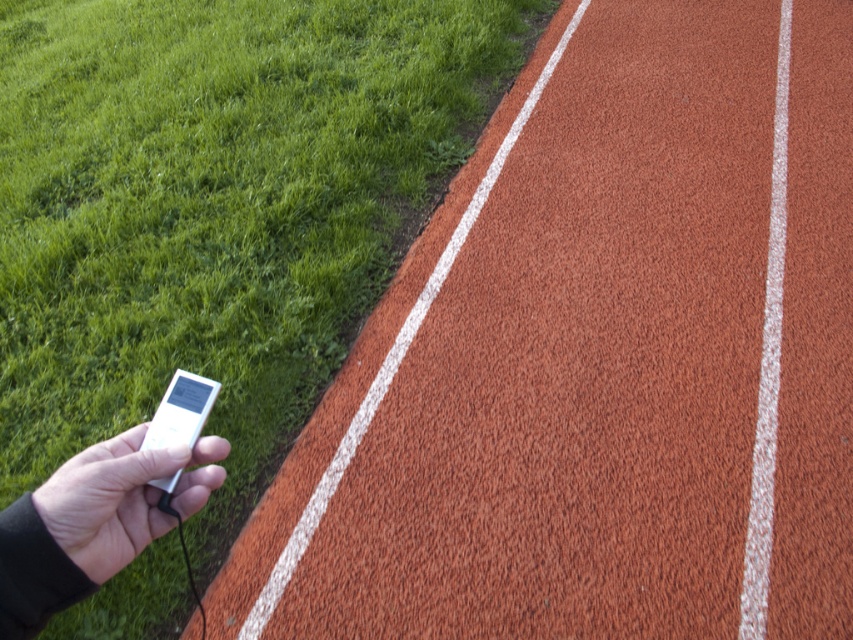
Question: Does white matte ipod at lower left appear on the right side of white matte/silicone mp3 player at lower left?

Choices:
 (A) yes
 (B) no

Answer: (B)

Question: Which of the following is the farthest from the observer?

Choices:
 (A) (184, 380)
 (B) (112, 452)

Answer: (A)

Question: Is white matte ipod at lower left closer to camera compared to white matte/silicone mp3 player at lower left?

Choices:
 (A) yes
 (B) no

Answer: (A)

Question: Which point is farther to the camera?

Choices:
 (A) (108, 497)
 (B) (173, 396)

Answer: (B)

Question: Which point is closer to the camera taking this photo?

Choices:
 (A) (148, 436)
 (B) (90, 568)

Answer: (B)

Question: Observing the image, what is the correct spatial positioning of white matte ipod at lower left in reference to white matte/silicone mp3 player at lower left?

Choices:
 (A) above
 (B) below

Answer: (B)